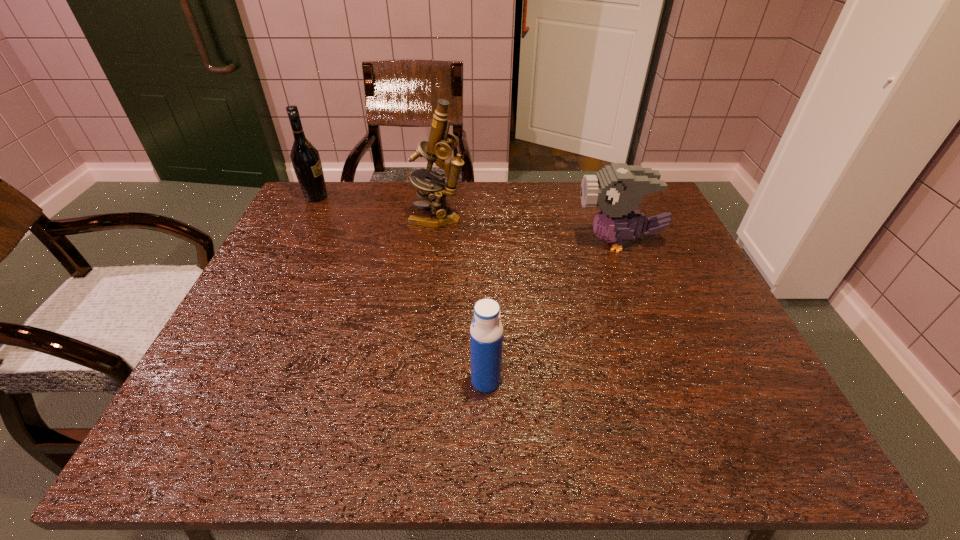
Identify the location of free region that satisfies the following two spatial constraints: 1. on the back side of the tallest object; 2. on the label of the third shortest object. (441, 197).

Identify the location of free space that satisfies the following two spatial constraints: 1. on the label of the farthest object; 2. on the back side of the second object from left to right. (305, 219).

Locate an element on the screen. Image resolution: width=960 pixels, height=540 pixels. vacant area that satisfies the following two spatial constraints: 1. on the label of the wine bottle; 2. on the back side of the microscope is located at coordinates (305, 219).

Where is `free space that satisfies the following two spatial constraints: 1. on the back side of the microscope; 2. on the label of the third shortest object`? This screenshot has width=960, height=540. free space that satisfies the following two spatial constraints: 1. on the back side of the microscope; 2. on the label of the third shortest object is located at coordinates (441, 197).